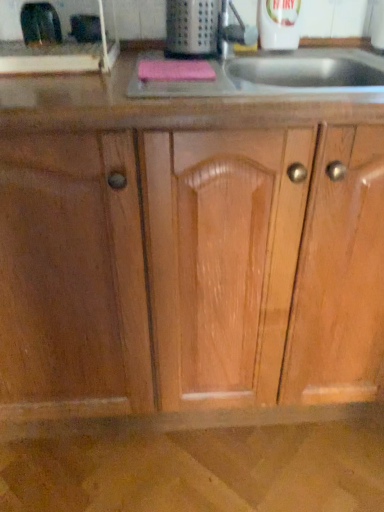
Find the location of a particular element. empty space that is to the right of metallic silver toaster at upper left, the second appliance from the left is located at coordinates (148, 45).